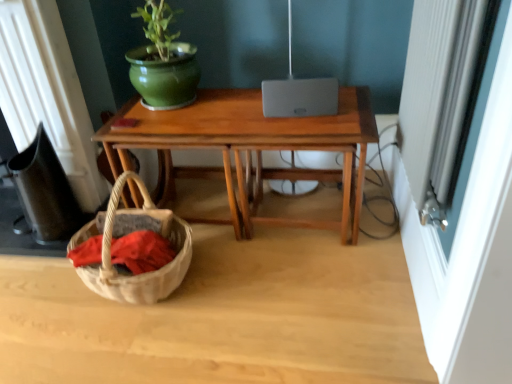
Question: Would you say satin silver lamp at center is outside wooden desk at center?

Choices:
 (A) yes
 (B) no

Answer: (A)

Question: Considering the relative sizes of satin silver lamp at center and wooden desk at center in the image provided, is satin silver lamp at center smaller than wooden desk at center?

Choices:
 (A) no
 (B) yes

Answer: (B)

Question: Is satin silver lamp at center positioned in front of wooden desk at center?

Choices:
 (A) no
 (B) yes

Answer: (A)

Question: Is satin silver lamp at center far away from wooden desk at center?

Choices:
 (A) yes
 (B) no

Answer: (B)

Question: Is satin silver lamp at center surrounding wooden desk at center?

Choices:
 (A) yes
 (B) no

Answer: (B)

Question: Considering the positions of point (398, 142) and point (287, 0), is point (398, 142) closer or farther from the camera than point (287, 0)?

Choices:
 (A) closer
 (B) farther

Answer: (B)

Question: Would you say white textured screen door at right is inside or outside satin silver lamp at center?

Choices:
 (A) outside
 (B) inside

Answer: (A)

Question: Visually, is white textured screen door at right positioned to the left or to the right of satin silver lamp at center?

Choices:
 (A) left
 (B) right

Answer: (B)

Question: Considering their positions, is white textured screen door at right located in front of or behind satin silver lamp at center?

Choices:
 (A) front
 (B) behind

Answer: (A)

Question: Relative to wooden desk at center, is white textured screen door at right in front or behind?

Choices:
 (A) front
 (B) behind

Answer: (A)

Question: Is white textured screen door at right taller or shorter than wooden desk at center?

Choices:
 (A) short
 (B) tall

Answer: (B)

Question: Considering the positions of white textured screen door at right and wooden desk at center in the image, is white textured screen door at right wider or thinner than wooden desk at center?

Choices:
 (A) thin
 (B) wide

Answer: (A)

Question: Looking at the image, does white textured screen door at right seem bigger or smaller compared to wooden desk at center?

Choices:
 (A) big
 (B) small

Answer: (B)

Question: From their relative heights in the image, would you say satin silver lamp at center is taller or shorter than white textured screen door at right?

Choices:
 (A) tall
 (B) short

Answer: (A)

Question: Looking at their shapes, would you say satin silver lamp at center is wider or thinner than white textured screen door at right?

Choices:
 (A) thin
 (B) wide

Answer: (B)